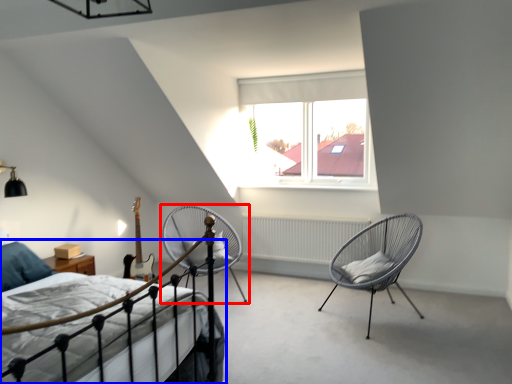
Question: Which object is closer to the camera taking this photo, chair (highlighted by a red box) or bed (highlighted by a blue box)?

Choices:
 (A) chair
 (B) bed

Answer: (B)